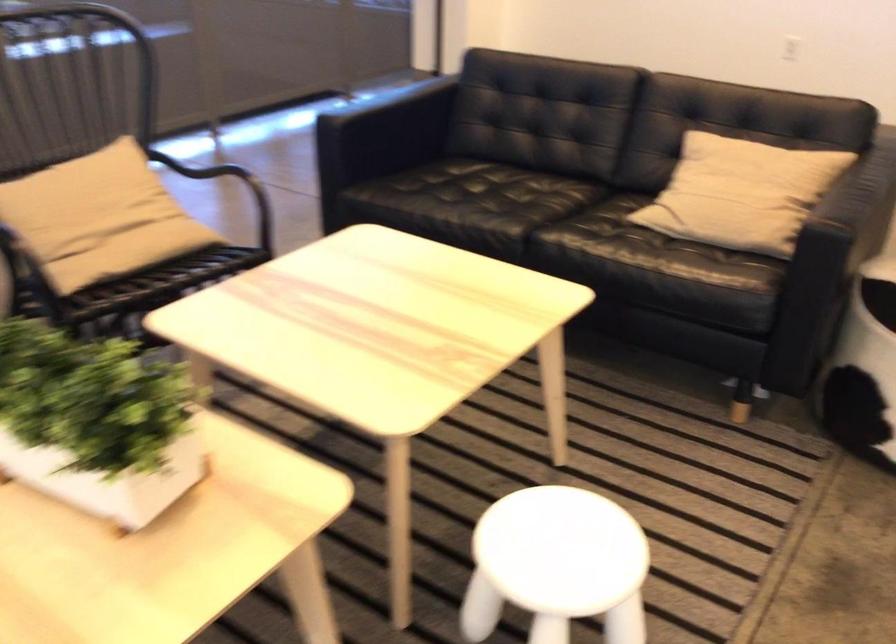
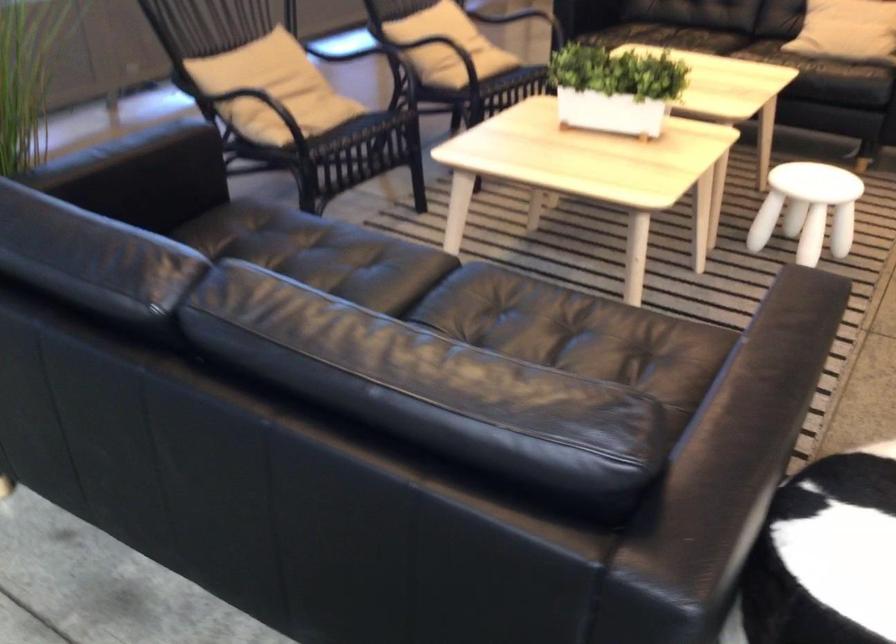
The point at (x=73, y=422) is marked in the first image. Where is the corresponding point in the second image?

(615, 88)